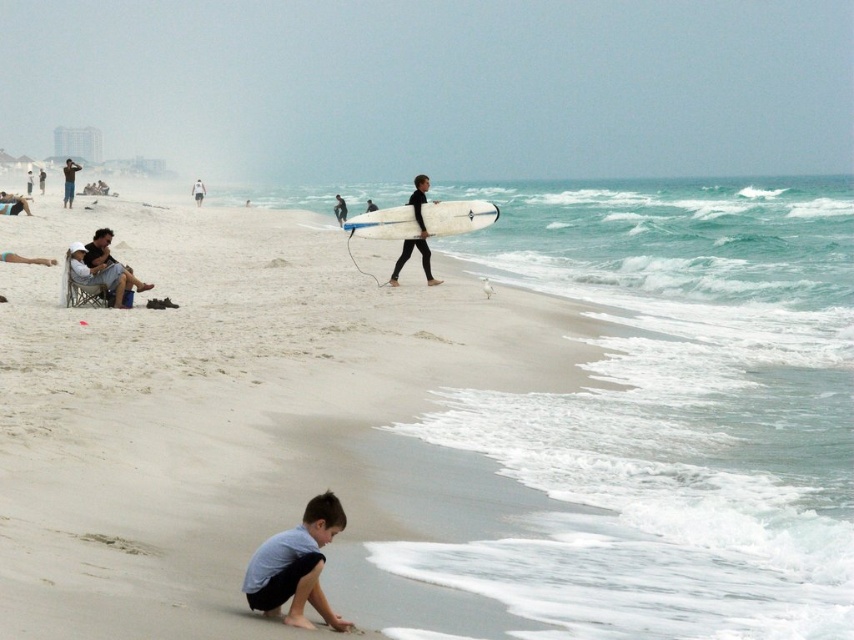
Question: Does light blue cotton shirt at lower center have a smaller size compared to white glossy surfboard at center?

Choices:
 (A) no
 (B) yes

Answer: (B)

Question: Is light brown fabric chair at upper left positioned behind dark blue wetsuit at center?

Choices:
 (A) yes
 (B) no

Answer: (B)

Question: Which is nearer to the light brown fabric chair at upper left?

Choices:
 (A) white t-shirt at center
 (B) dark blue wetsuit at center

Answer: (A)

Question: Which point is closer to the camera taking this photo?

Choices:
 (A) (199, 205)
 (B) (69, 177)
 (C) (53, 340)

Answer: (C)

Question: Which point is farther to the camera?

Choices:
 (A) (291, 538)
 (B) (418, 224)
 (C) (108, 236)
 (D) (349, 278)

Answer: (D)

Question: Where is white sand at center located in relation to white glossy surfboard at center in the image?

Choices:
 (A) left
 (B) right

Answer: (A)